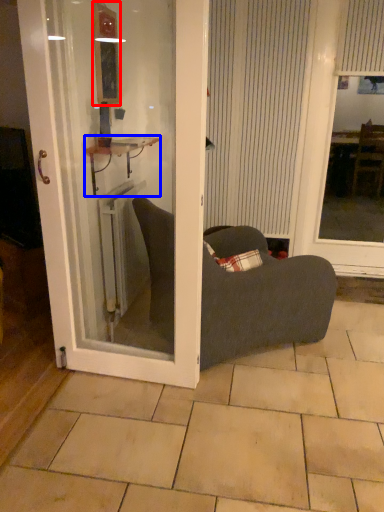
Question: Which object appears farthest to the camera in this image, mirror (highlighted by a red box) or cabinetry (highlighted by a blue box)?

Choices:
 (A) mirror
 (B) cabinetry

Answer: (A)